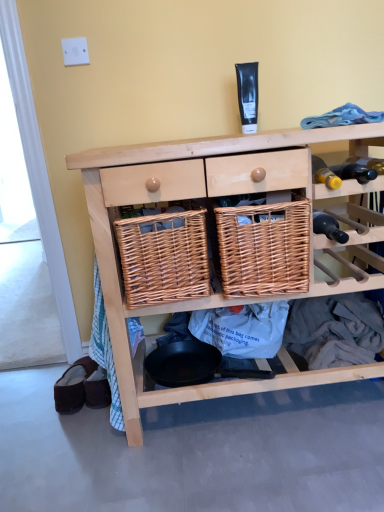
Question: Would you say woven brown basket at center, which is counted as the second basket, starting from the left, contains black matte tube at upper center?

Choices:
 (A) yes
 (B) no

Answer: (B)

Question: Is woven brown basket at center, which is counted as the second basket, starting from the left, taller than black matte tube at upper center?

Choices:
 (A) no
 (B) yes

Answer: (B)

Question: Is woven brown basket at center, which appears as the first basket when viewed from the right, bigger than black matte tube at upper center?

Choices:
 (A) no
 (B) yes

Answer: (B)

Question: From the image's perspective, would you say woven brown basket at center, which is counted as the second basket, starting from the left, is positioned over black matte tube at upper center?

Choices:
 (A) yes
 (B) no

Answer: (B)

Question: Is woven brown basket at center, which is counted as the second basket, starting from the left, further to camera compared to black matte tube at upper center?

Choices:
 (A) yes
 (B) no

Answer: (B)

Question: Is point (321, 214) closer or farther from the camera than point (253, 100)?

Choices:
 (A) farther
 (B) closer

Answer: (B)

Question: Would you say black glass bottle at right is inside or outside black matte tube at upper center?

Choices:
 (A) inside
 (B) outside

Answer: (B)

Question: Based on their sizes in the image, would you say black glass bottle at right is bigger or smaller than black matte tube at upper center?

Choices:
 (A) big
 (B) small

Answer: (B)

Question: From the image's perspective, is black glass bottle at right positioned above or below black matte tube at upper center?

Choices:
 (A) below
 (B) above

Answer: (A)

Question: In the image, is black matte tube at upper center positioned in front of or behind woven brown basket at center, which appears as the first basket when viewed from the right?

Choices:
 (A) behind
 (B) front

Answer: (A)

Question: From the image's perspective, is black matte tube at upper center located above or below woven brown basket at center, which appears as the first basket when viewed from the right?

Choices:
 (A) above
 (B) below

Answer: (A)

Question: Visually, is black matte tube at upper center positioned to the left or to the right of woven brown basket at center, which appears as the first basket when viewed from the right?

Choices:
 (A) left
 (B) right

Answer: (B)

Question: Looking at the image, does black matte tube at upper center seem bigger or smaller compared to woven brown basket at center, which appears as the first basket when viewed from the right?

Choices:
 (A) big
 (B) small

Answer: (B)

Question: Looking at their shapes, would you say natural wood wicker baskets at center is wider or thinner than brown suede slippers at lower left?

Choices:
 (A) thin
 (B) wide

Answer: (B)

Question: Considering their positions, is natural wood wicker baskets at center located in front of or behind brown suede slippers at lower left?

Choices:
 (A) behind
 (B) front

Answer: (B)